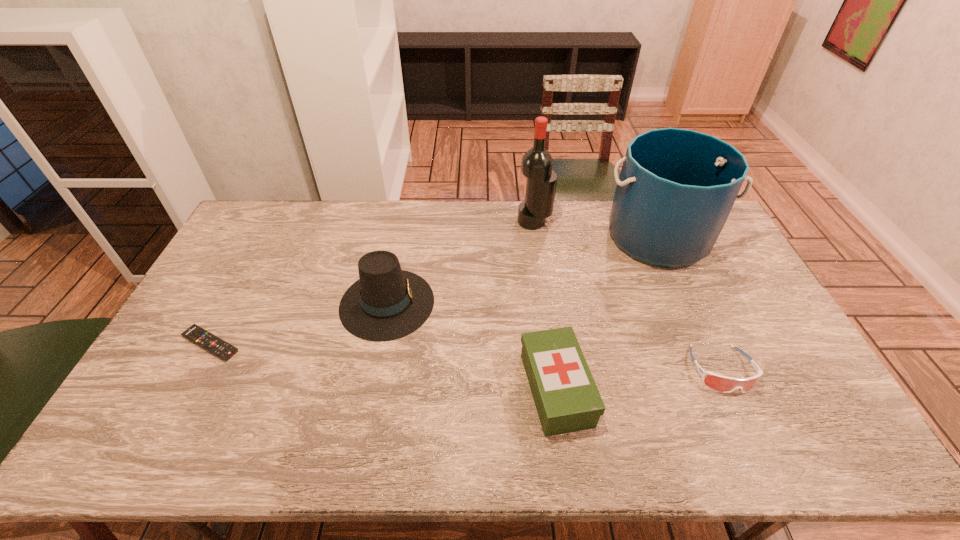
Where is `vacant area in the image that satisfies the following two spatial constraints: 1. on the front side of the first-aid kit; 2. on the left side of the shortest object`? The width and height of the screenshot is (960, 540). vacant area in the image that satisfies the following two spatial constraints: 1. on the front side of the first-aid kit; 2. on the left side of the shortest object is located at coordinates (186, 389).

The width and height of the screenshot is (960, 540). Find the location of `free space that satisfies the following two spatial constraints: 1. on the back side of the third shortest object; 2. on the front-facing side of the hat`. free space that satisfies the following two spatial constraints: 1. on the back side of the third shortest object; 2. on the front-facing side of the hat is located at coordinates (544, 303).

Find the location of a particular element. The image size is (960, 540). free space that satisfies the following two spatial constraints: 1. on the front side of the second tallest object; 2. on the left side of the wine bottle is located at coordinates (537, 238).

You are a GUI agent. You are given a task and a screenshot of the screen. Output one action in this format:
    pyautogui.click(x=<x>, y=<y>)
    Task: Click on the free spot that satisfies the following two spatial constraints: 1. on the front-facing side of the third tallest object; 2. on the front side of the leftmost object
    The height and width of the screenshot is (540, 960).
    Given the screenshot: What is the action you would take?
    (x=379, y=344)